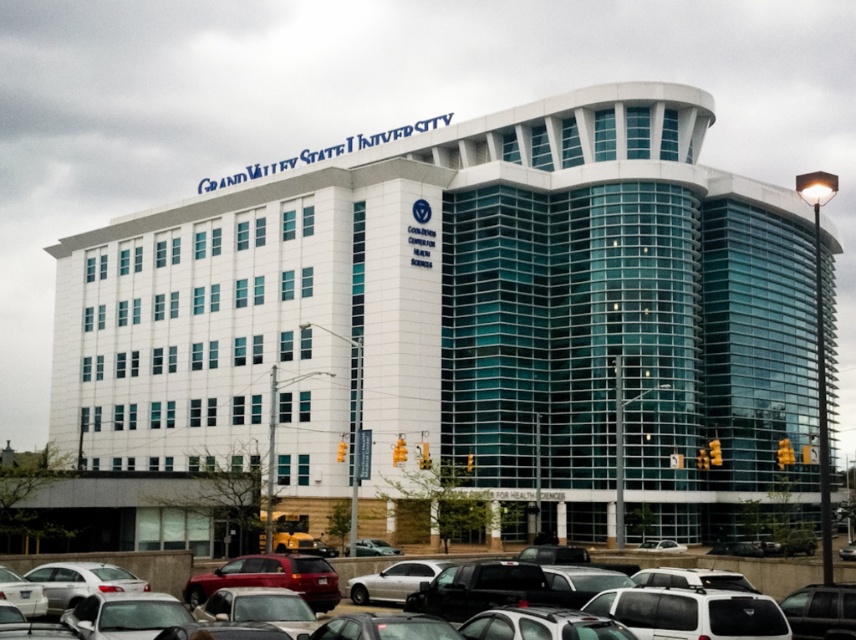
Does matte red suv at center have a lesser width compared to satin silver sedan at lower left?

No, matte red suv at center is not thinner than satin silver sedan at lower left.

Is point (305, 596) positioned in front of point (36, 570)?

Yes, point (305, 596) is closer to viewer.

The height and width of the screenshot is (640, 856). Find the location of `matte red suv at center`. matte red suv at center is located at coordinates (271, 577).

Does metallic gray cars at lower center have a smaller size compared to metallic silver car at center?

Incorrect, metallic gray cars at lower center is not smaller in size than metallic silver car at center.

In the scene shown: Who is more forward, (158, 550) or (367, 544)?

Point (158, 550) is more forward.

The height and width of the screenshot is (640, 856). I want to click on metallic gray cars at lower center, so click(x=741, y=568).

Who is more forward, (367, 564) or (58, 573)?

Point (58, 573)

Does metallic gray cars at lower center appear on the left side of satin silver sedan at lower left?

Incorrect, metallic gray cars at lower center is not on the left side of satin silver sedan at lower left.

Is point (360, 572) closer to camera compared to point (45, 588)?

No, it is behind (45, 588).

Locate an element on the screen. Image resolution: width=856 pixels, height=640 pixels. metallic gray cars at lower center is located at coordinates (741, 568).